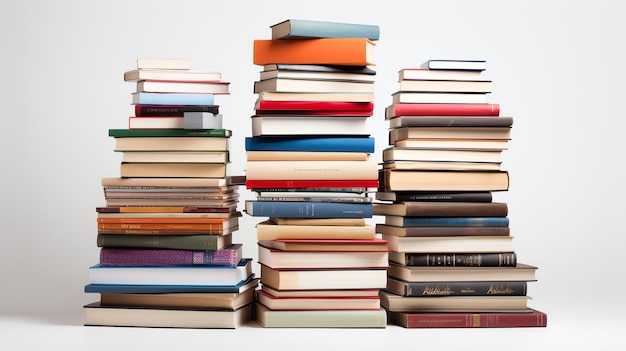
I want to click on black books, so click(x=437, y=290), click(x=442, y=256), click(x=449, y=195), click(x=93, y=305), click(x=170, y=108), click(x=401, y=93), click(x=290, y=67), click(x=277, y=286).